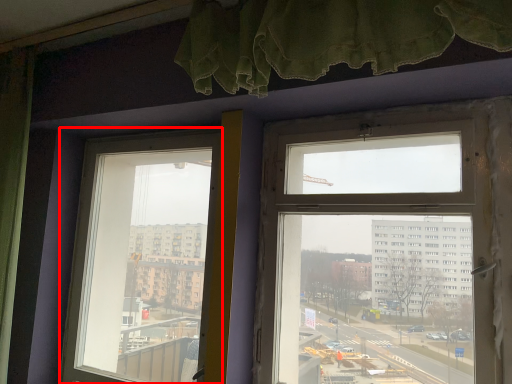
Question: From the image's perspective, considering the relative positions of window (annotated by the red box) and window in the image provided, where is window (annotated by the red box) located with respect to the staircase?

Choices:
 (A) below
 (B) above

Answer: (A)